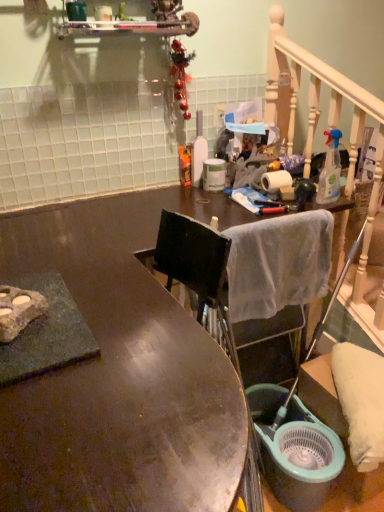
Question: Could you tell me if white soft towel at center is turned towards teal plastic bucket at lower right?

Choices:
 (A) yes
 (B) no

Answer: (B)

Question: From the image's perspective, is white soft towel at center beneath teal plastic bucket at lower right?

Choices:
 (A) yes
 (B) no

Answer: (B)

Question: Is white soft towel at center positioned before teal plastic bucket at lower right?

Choices:
 (A) no
 (B) yes

Answer: (B)

Question: Does white soft towel at center have a greater width compared to teal plastic bucket at lower right?

Choices:
 (A) no
 (B) yes

Answer: (A)

Question: Does white soft towel at center appear on the left side of teal plastic bucket at lower right?

Choices:
 (A) no
 (B) yes

Answer: (B)

Question: From a real-world perspective, relative to shiny brown desk at center, is white soft towel at center vertically above or below?

Choices:
 (A) below
 (B) above

Answer: (B)

Question: Visually, is white soft towel at center positioned to the left or to the right of shiny brown desk at center?

Choices:
 (A) right
 (B) left

Answer: (A)

Question: From their relative heights in the image, would you say white soft towel at center is taller or shorter than shiny brown desk at center?

Choices:
 (A) tall
 (B) short

Answer: (B)

Question: From the image's perspective, is white soft towel at center above or below shiny brown desk at center?

Choices:
 (A) below
 (B) above

Answer: (B)

Question: Is shiny brown desk at center bigger or smaller than clear plastic spray bottle at upper right, marked as the 2th bottle in a left-to-right arrangement?

Choices:
 (A) big
 (B) small

Answer: (A)

Question: Is point (211, 445) closer or farther from the camera than point (327, 151)?

Choices:
 (A) farther
 (B) closer

Answer: (B)

Question: Would you say shiny brown desk at center is to the left or to the right of clear plastic spray bottle at upper right, marked as the 2th bottle in a left-to-right arrangement, in the picture?

Choices:
 (A) left
 (B) right

Answer: (A)

Question: Considering their positions, is shiny brown desk at center located in front of or behind clear plastic spray bottle at upper right, positioned as the 1th bottle in front-to-back order?

Choices:
 (A) front
 (B) behind

Answer: (A)

Question: Relative to white matte toilet paper at upper right, is white soft towel at center in front or behind?

Choices:
 (A) behind
 (B) front

Answer: (B)

Question: Does point (281, 284) appear closer or farther from the camera than point (271, 185)?

Choices:
 (A) closer
 (B) farther

Answer: (A)